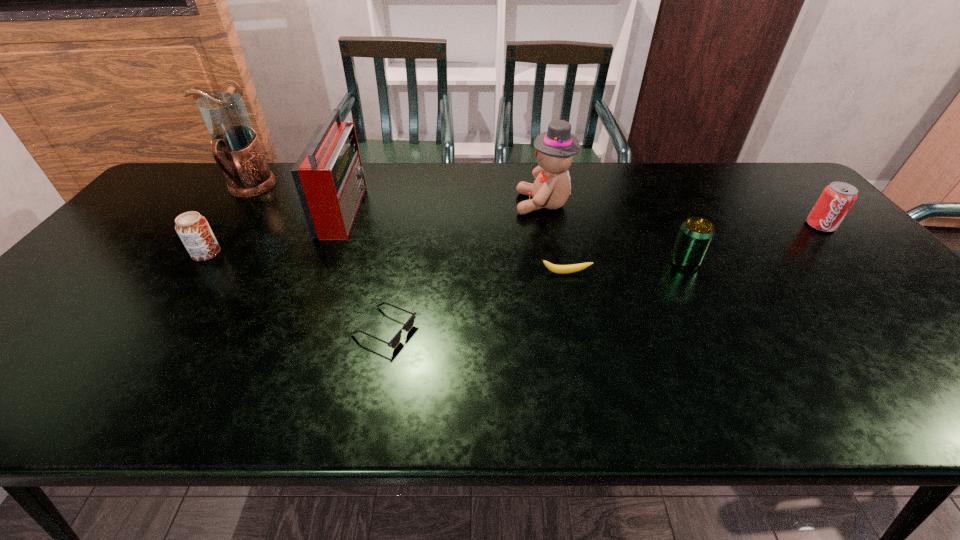
I want to click on free point that satisfies the following two spatial constraints: 1. on the upward curve of the banana; 2. on the lenses of the nearest object, so click(578, 329).

The height and width of the screenshot is (540, 960). What are the coordinates of `vacant space that satisfies the following two spatial constraints: 1. on the front-facing side of the seventh object from left to right; 2. on the left side of the radio receiver` in the screenshot? It's located at (323, 261).

At what (x,y) coordinates should I click in order to perform the action: click on vacant space that satisfies the following two spatial constraints: 1. with the handle on the side of the pitcher; 2. on the left side of the left beer can. Please return your answer as a coordinate pair (x, y). Looking at the image, I should click on click(204, 254).

I want to click on vacant region that satisfies the following two spatial constraints: 1. on the front side of the right beer can; 2. on the right side of the left beer can, so click(x=202, y=261).

The height and width of the screenshot is (540, 960). I want to click on vacant space that satisfies the following two spatial constraints: 1. on the upward curve of the seventh tallest object; 2. on the lenses of the shortest object, so click(578, 329).